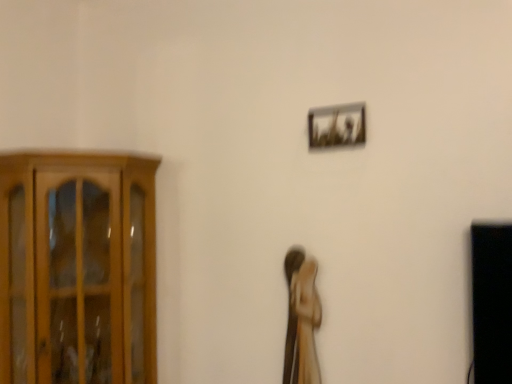
Question: Should I look upward or downward to see wooden statue at center?

Choices:
 (A) down
 (B) up

Answer: (A)

Question: Does wooden cabinet at left come behind wooden statue at center?

Choices:
 (A) no
 (B) yes

Answer: (A)

Question: Can you confirm if wooden cabinet at left is bigger than wooden statue at center?

Choices:
 (A) no
 (B) yes

Answer: (B)

Question: Can you confirm if wooden cabinet at left is taller than wooden statue at center?

Choices:
 (A) yes
 (B) no

Answer: (A)

Question: Can you confirm if wooden cabinet at left is positioned to the right of wooden statue at center?

Choices:
 (A) no
 (B) yes

Answer: (A)

Question: From a real-world perspective, is wooden cabinet at left over wooden statue at center?

Choices:
 (A) no
 (B) yes

Answer: (B)

Question: Does wooden cabinet at left have a lesser height compared to wooden statue at center?

Choices:
 (A) yes
 (B) no

Answer: (B)

Question: Is wooden statue at center oriented towards metallic silver frame at upper right?

Choices:
 (A) yes
 (B) no

Answer: (B)

Question: Is wooden statue at center to the right of metallic silver frame at upper right from the viewer's perspective?

Choices:
 (A) no
 (B) yes

Answer: (A)

Question: Does wooden statue at center lie behind metallic silver frame at upper right?

Choices:
 (A) yes
 (B) no

Answer: (A)

Question: From the image's perspective, would you say wooden statue at center is positioned over metallic silver frame at upper right?

Choices:
 (A) yes
 (B) no

Answer: (B)

Question: Is wooden statue at center bigger than metallic silver frame at upper right?

Choices:
 (A) yes
 (B) no

Answer: (A)

Question: Is wooden statue at center shorter than metallic silver frame at upper right?

Choices:
 (A) no
 (B) yes

Answer: (A)

Question: From the image's perspective, is metallic silver frame at upper right on wooden cabinet at left?

Choices:
 (A) no
 (B) yes

Answer: (B)